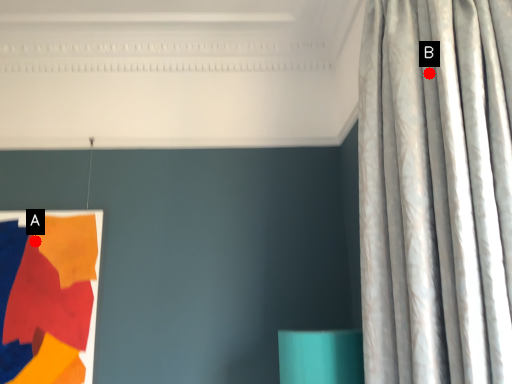
Question: Two points are circled on the image, labeled by A and B beside each circle. Which point is closer to the camera?

Choices:
 (A) A is closer
 (B) B is closer

Answer: (B)